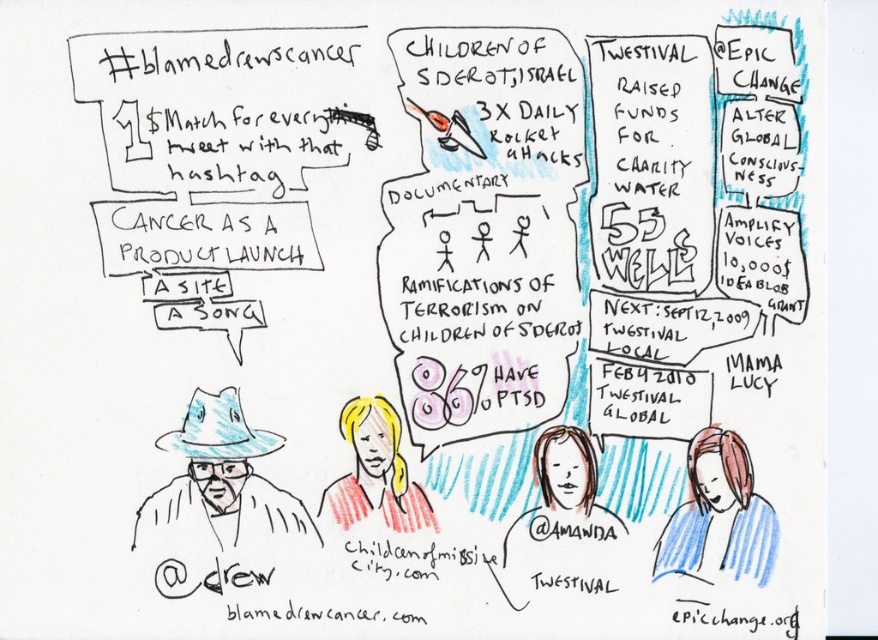
Does blonde hair at lower right appear under blonde hair at center?

Correct, blonde hair at lower right is located below blonde hair at center.

The width and height of the screenshot is (878, 640). Describe the element at coordinates (718, 516) in the screenshot. I see `blonde hair at lower right` at that location.

Where is `blonde hair at lower right`? blonde hair at lower right is located at coordinates (718, 516).

Is point (175, 560) farther from viewer compared to point (364, 472)?

No, (175, 560) is in front of (364, 472).

Between blue paper hat at left and blonde hair at center, which one appears on the right side from the viewer's perspective?

blonde hair at center

Image resolution: width=878 pixels, height=640 pixels. In order to click on blue paper hat at left in this screenshot , I will do `click(218, 500)`.

The height and width of the screenshot is (640, 878). I want to click on blue paper hat at left, so click(x=218, y=500).

Between point (545, 577) and point (747, 556), which one is positioned behind?

The point (545, 577) is behind.

Is point (541, 472) closer to viewer compared to point (742, 512)?

That is False.

Is point (545, 522) positioned behind point (732, 468)?

Yes, point (545, 522) is farther from viewer.

You are a GUI agent. You are given a task and a screenshot of the screen. Output one action in this format:
    pyautogui.click(x=<x>, y=<y>)
    Task: Click on the smooth skin portrait at center
    This screenshot has width=878, height=640.
    Given the screenshot: What is the action you would take?
    pyautogui.click(x=560, y=525)